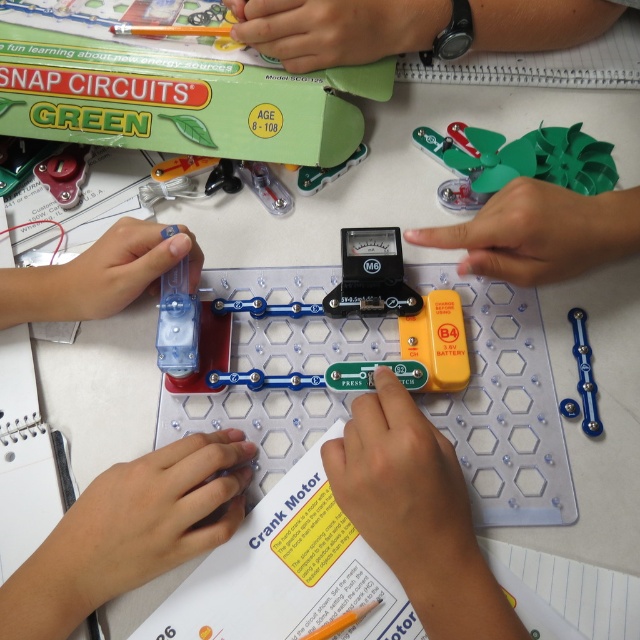
Question: Does green plastic propeller at upper right lie in front of metallic green gear at center?

Choices:
 (A) no
 (B) yes

Answer: (B)

Question: Which point is farther from the camera taking this photo?

Choices:
 (A) (172, 157)
 (B) (280, 381)
 (C) (333, 179)

Answer: (A)

Question: Can you confirm if clear plastic screwdriver at center is positioned above metallic green gear at center?

Choices:
 (A) no
 (B) yes

Answer: (A)

Question: Considering the real-world distances, which object is farthest from the metallic green gear at center?

Choices:
 (A) metallic red screw at upper left
 (B) blue metallic gear at center

Answer: (B)

Question: From the image, what is the correct spatial relationship of green plastic propeller at upper right in relation to black plastic meter at center?

Choices:
 (A) below
 (B) above

Answer: (B)

Question: Estimate the real-world distances between objects in this image. Which object is farther from the blue metallic gear at center?

Choices:
 (A) clear plastic screwdriver at center
 (B) metallic blue gear at center
 (C) black plastic meter at center

Answer: (B)